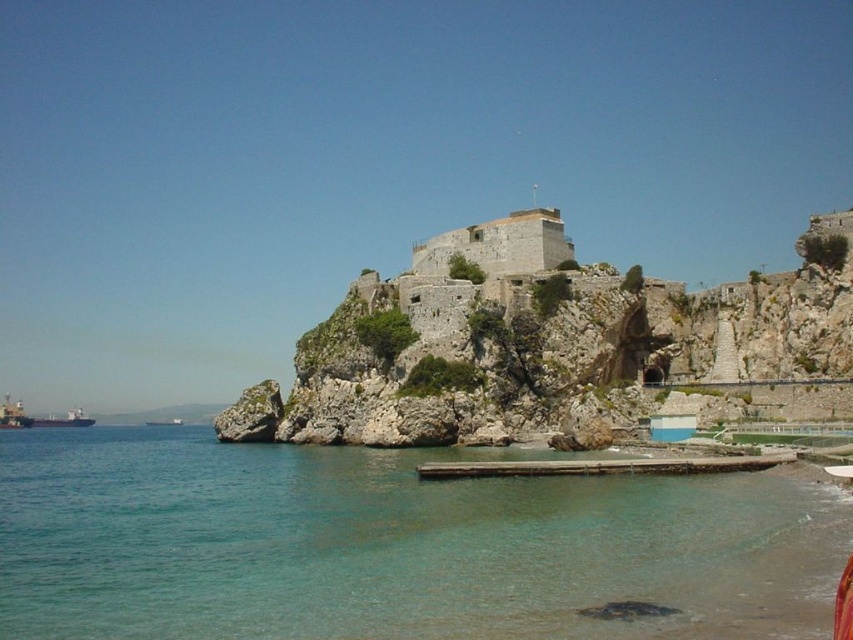
You are standing on the wooden pier and want to board the metallic gray ship at left. However, you notice the clear water at lower left. Is the ship accessible from your current position?

The clear water at lower left is positioned over metallic gray ship at left, meaning the ship is submerged under the water and not accessible from the wooden pier.

You are a sailor approaching the coast and see the clear water at lower left and the green matte cargo ship at lower left. Which one is located to the right from your perspective?

The clear water at lower left is positioned on the right side of green matte cargo ship at lower left, so from your perspective, the clear water at lower left is to the right of the green matte cargo ship at lower left.

You are a marine biologist studying water clarity in the bay. You observe the point marked at coordinates [372,541]. Based on the scene description, what can you infer about the water clarity at this location?

The point marked at coordinates [372,541] indicates clear water at lower left, so the water clarity there is good enough to be described as clear.